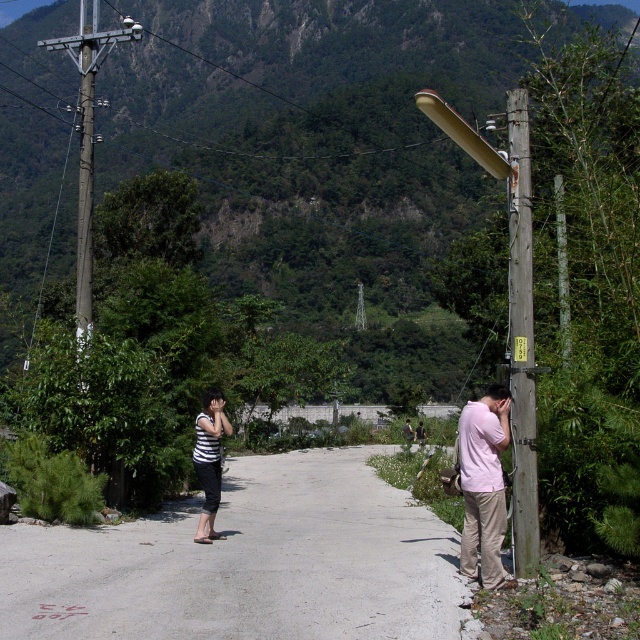
In the scene shown: Can you confirm if gray concrete road at center is positioned above wooden utility pole at right?

No.

Where is `gray concrete road at center`? Image resolution: width=640 pixels, height=640 pixels. gray concrete road at center is located at coordinates (248, 563).

Who is more forward, [218,496] or [410,442]?

Point [218,496] is in front.

Does point (204, 524) come in front of point (416, 436)?

That is True.

Who is more distant from viewer, (218, 428) or (420, 420)?

Point (420, 420)

Where is `striped fabric shirt at center`? This screenshot has height=640, width=640. striped fabric shirt at center is located at coordinates (209, 460).

Who is shorter, pink matte shirt at right or striped fabric shirt at center?

striped fabric shirt at center

Does pink matte shirt at right appear under striped fabric shirt at center?

Yes.

Identify the location of pink matte shirt at right. (483, 483).